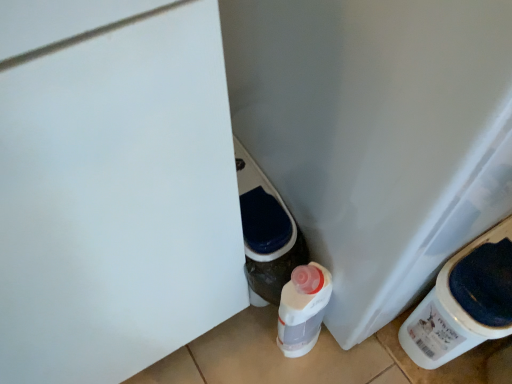
Question: From a real-world perspective, is white plastic water cooler at lower right above or below white matte door at center?

Choices:
 (A) below
 (B) above

Answer: (B)

Question: Considering the relative positions of white plastic water cooler at lower right and white matte door at center in the image provided, is white plastic water cooler at lower right to the left or to the right of white matte door at center?

Choices:
 (A) left
 (B) right

Answer: (B)

Question: Considering the positions of white plastic water cooler at lower right and white matte door at center in the image, is white plastic water cooler at lower right wider or thinner than white matte door at center?

Choices:
 (A) wide
 (B) thin

Answer: (A)

Question: Is white matte door at center taller or shorter than white plastic water cooler at lower right?

Choices:
 (A) short
 (B) tall

Answer: (B)

Question: Is white matte door at center in front of or behind white plastic water cooler at lower right in the image?

Choices:
 (A) front
 (B) behind

Answer: (A)

Question: Based on their sizes in the image, would you say white matte door at center is bigger or smaller than white plastic water cooler at lower right?

Choices:
 (A) small
 (B) big

Answer: (A)

Question: From the image's perspective, is white matte door at center above or below white plastic water cooler at lower right?

Choices:
 (A) above
 (B) below

Answer: (B)